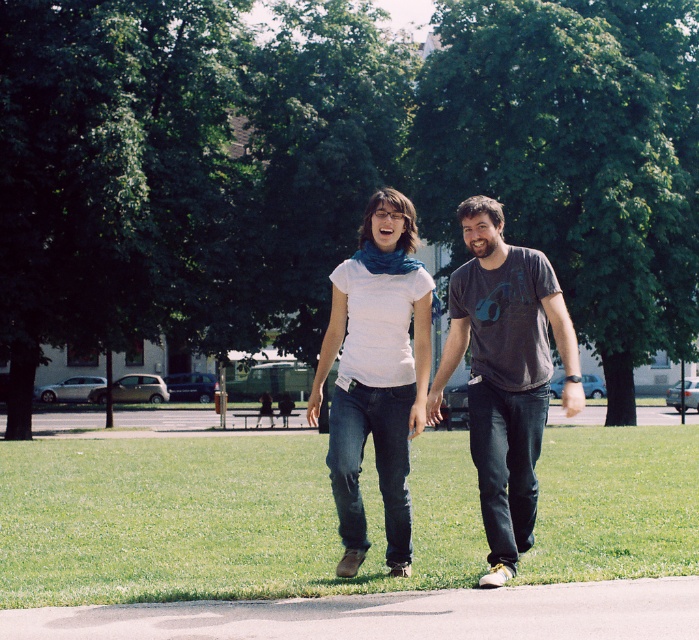
Question: Which point is closer to the camera?

Choices:
 (A) dark gray t-shirt at center
 (B) green grass at center

Answer: (A)

Question: Which object appears farthest from the camera in this image?

Choices:
 (A) gray asphalt at lower center
 (B) green grass at center
 (C) dark gray t-shirt at center

Answer: (B)

Question: In this image, where is green grass at center located relative to gray asphalt at lower center?

Choices:
 (A) below
 (B) above

Answer: (B)

Question: Based on their relative distances, which object is nearer to the green grass at center?

Choices:
 (A) gray asphalt at lower center
 (B) dark gray t-shirt at center

Answer: (B)

Question: Is green grass at center smaller than dark gray t-shirt at center?

Choices:
 (A) no
 (B) yes

Answer: (A)

Question: Does gray asphalt at lower center appear on the left side of dark gray t-shirt at center?

Choices:
 (A) yes
 (B) no

Answer: (A)